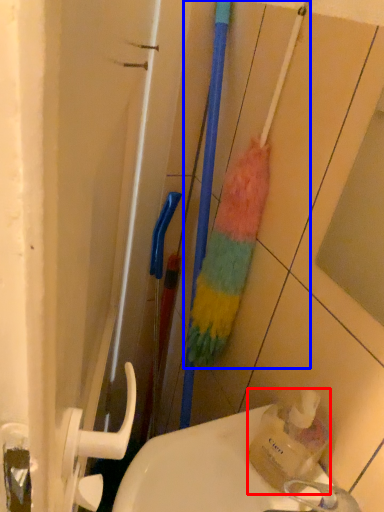
Question: Which point is closer to the camera, bottle (highlighted by a red box) or brush (highlighted by a blue box)?

Choices:
 (A) bottle
 (B) brush

Answer: (A)